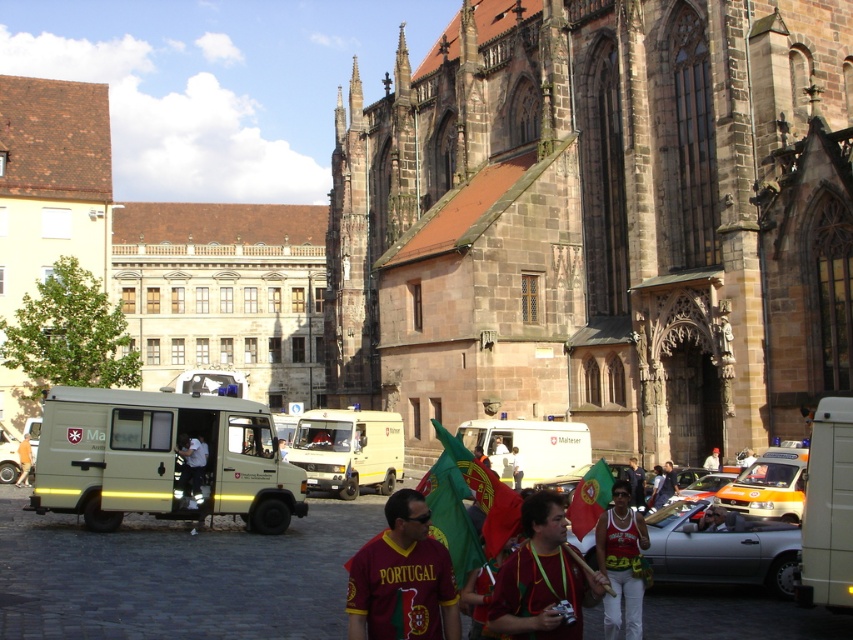
Can you confirm if beige matte ambulance at center-left is thinner than matte black jacket at center?

No.

Can you confirm if beige matte ambulance at center-left is positioned below matte black jacket at center?

Actually, beige matte ambulance at center-left is above matte black jacket at center.

Is point (140, 452) positioned after point (630, 458)?

No, (140, 452) is closer to viewer.

Locate an element on the screen. Image resolution: width=853 pixels, height=640 pixels. beige matte ambulance at center-left is located at coordinates (161, 458).

Is the position of light beige fabric uniform at center less distant than that of matte black jacket at center?

No.

Which is in front, point (193, 472) or point (640, 493)?

Point (193, 472)

The height and width of the screenshot is (640, 853). I want to click on light beige fabric uniform at center, so tap(190, 467).

Does yellow matte ambulance at center-right appear on the right side of matte black shirt at center?

Correct, you'll find yellow matte ambulance at center-right to the right of matte black shirt at center.

The image size is (853, 640). Find the location of `yellow matte ambulance at center-right`. yellow matte ambulance at center-right is located at coordinates (769, 484).